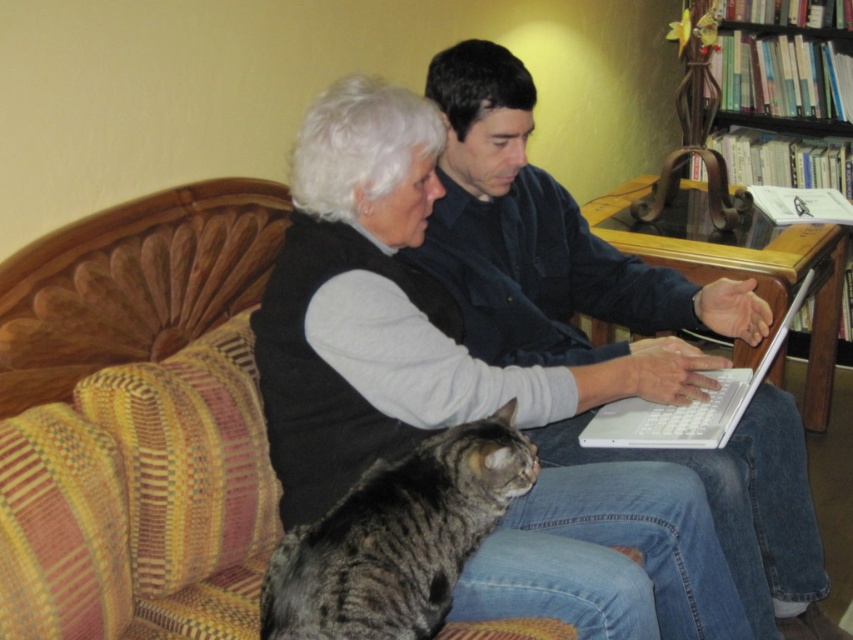
Who is positioned more to the left, matte black shirt at center or white plastic laptop at center?

From the viewer's perspective, matte black shirt at center appears more on the left side.

Does point (471, 147) come behind point (672, 444)?

Yes, point (471, 147) is behind point (672, 444).

At what (x,y) coordinates should I click in order to perform the action: click on matte black shirt at center. Please return your answer as a coordinate pair (x, y). Image resolution: width=853 pixels, height=640 pixels. Looking at the image, I should click on (540, 236).

Does tabby fur cat at lower left appear on the right side of wooden bookshelf at upper right?

In fact, tabby fur cat at lower left is to the left of wooden bookshelf at upper right.

Does tabby fur cat at lower left have a smaller size compared to wooden bookshelf at upper right?

Correct, tabby fur cat at lower left occupies less space than wooden bookshelf at upper right.

What do you see at coordinates (397, 538) in the screenshot? I see `tabby fur cat at lower left` at bounding box center [397, 538].

Find the location of a particular element. tabby fur cat at lower left is located at coordinates (397, 538).

Can you confirm if yellow striped fabric couch at center is bigger than matte black shirt at center?

No, yellow striped fabric couch at center is not bigger than matte black shirt at center.

Which is above, yellow striped fabric couch at center or matte black shirt at center?

Positioned higher is yellow striped fabric couch at center.

Does point (173, 316) come in front of point (746, 342)?

Yes, it is in front of point (746, 342).

Image resolution: width=853 pixels, height=640 pixels. Identify the location of yellow striped fabric couch at center. (137, 417).